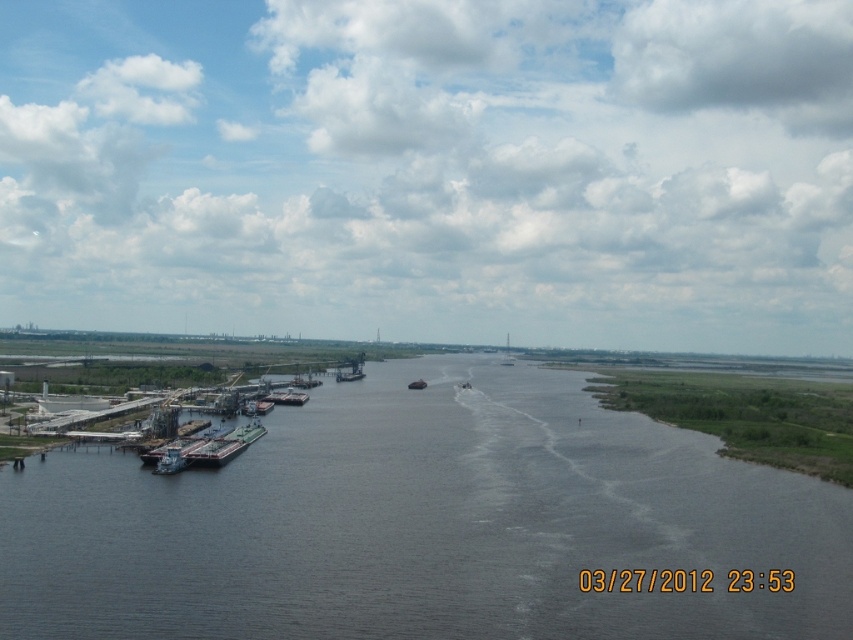
Is metallic gray barge at lower left thinner than metallic gray barge at center-left?

Yes, metallic gray barge at lower left is thinner than metallic gray barge at center-left.

Which is in front, point (171, 451) or point (291, 401)?

Point (171, 451) is more forward.

Between point (172, 461) and point (271, 397), which one is positioned in front?

Positioned in front is point (172, 461).

Identify the location of metallic gray barge at lower left. Image resolution: width=853 pixels, height=640 pixels. (170, 461).

Which is in front, point (326, 493) or point (415, 381)?

Point (326, 493) is more forward.

Is dark gray water at center above metallic gray boat at center?

No, dark gray water at center is not above metallic gray boat at center.

Does point (502, 460) come behind point (415, 384)?

No.

Where is `dark gray water at center`? The image size is (853, 640). dark gray water at center is located at coordinates (424, 524).

Looking at this image, does metallic gray barge at left have a larger size compared to metallic gray barge at lower left?

Yes.

Does metallic gray barge at left appear on the right side of metallic gray barge at lower left?

In fact, metallic gray barge at left is to the left of metallic gray barge at lower left.

Find the location of a particular element. metallic gray barge at left is located at coordinates (224, 445).

Image resolution: width=853 pixels, height=640 pixels. I want to click on metallic gray barge at left, so click(224, 445).